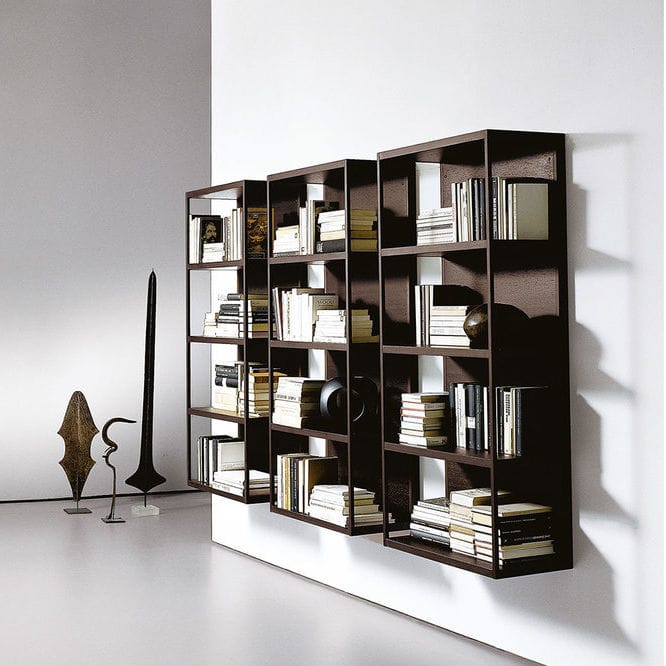
Find the location of a particular element. books stacked on third shelf is located at coordinates (220, 402), (226, 382), (230, 363), (258, 404), (264, 388), (268, 367), (236, 396), (242, 373), (242, 364).